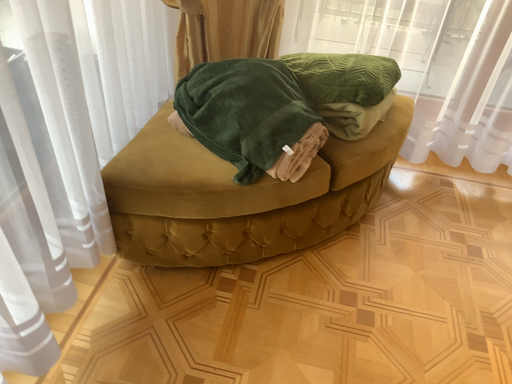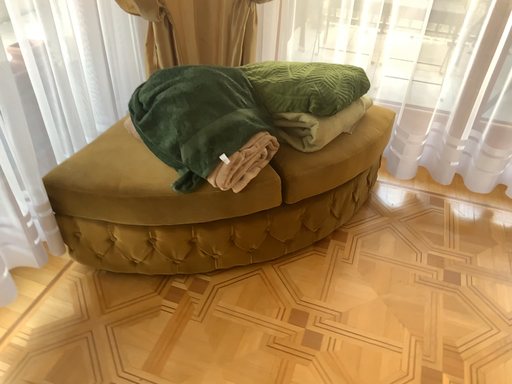
Question: Which way did the camera rotate in the video?

Choices:
 (A) rotated left
 (B) rotated right

Answer: (A)